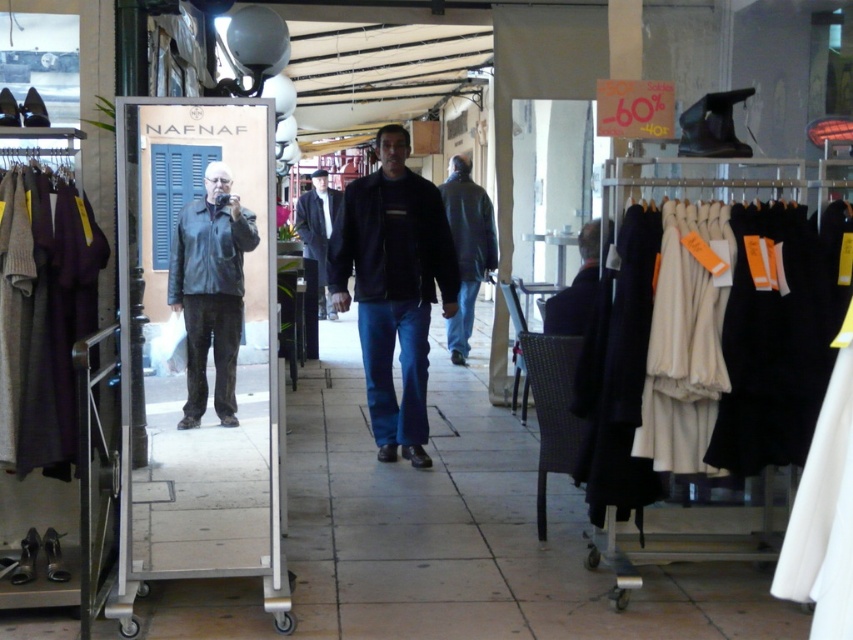
Question: Is dark gray wool coat at center below dark blue fabric coat at center?

Choices:
 (A) yes
 (B) no

Answer: (B)

Question: Does white woolen dress at right have a smaller size compared to dark purple sweater at left?

Choices:
 (A) no
 (B) yes

Answer: (A)

Question: Is dark blue denim jeans at center thinner than leather jacket at left?

Choices:
 (A) yes
 (B) no

Answer: (B)

Question: Which is nearer to the white woolen dress at right?

Choices:
 (A) leather jacket at left
 (B) dark blue fabric coat at center
 (C) dark gray wool coat at center

Answer: (B)

Question: Which is nearer to the dark purple sweater at left?

Choices:
 (A) dark blue leather jacket at center
 (B) white woolen dress at right
 (C) dark blue fabric coat at center

Answer: (C)

Question: Among these objects, which one is nearest to the camera?

Choices:
 (A) leather jacket at left
 (B) dark blue fabric coat at center

Answer: (A)